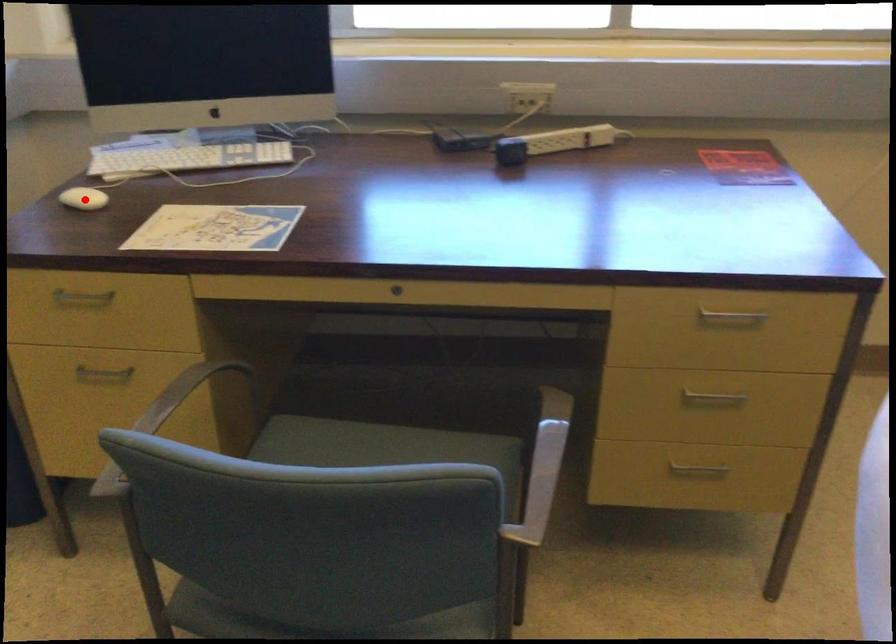
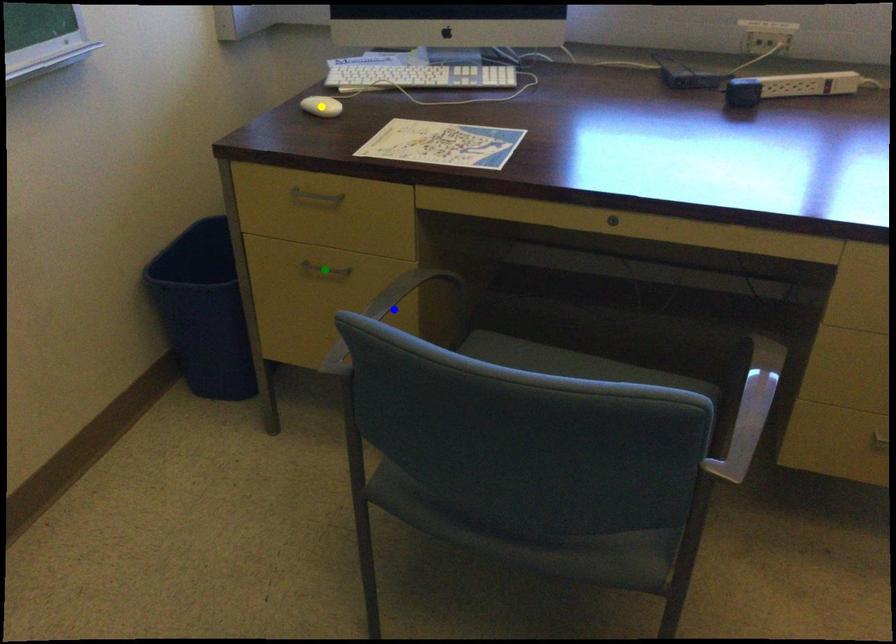
Question: I am providing you with two images of the same scene from different viewpoints. A red point is marked on the first image. You are given multiple points on the second image. Which point in image 2 represents the same 3d spot as the red point in image 1?

Choices:
 (A) green point
 (B) yellow point
 (C) blue point

Answer: (B)